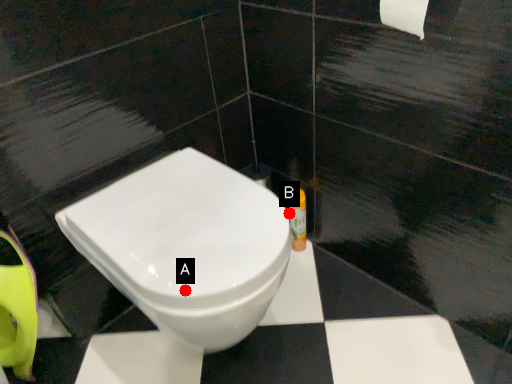
Question: Two points are circled on the image, labeled by A and B beside each circle. Which point is closer to the camera taking this photo?

Choices:
 (A) A is closer
 (B) B is closer

Answer: (A)